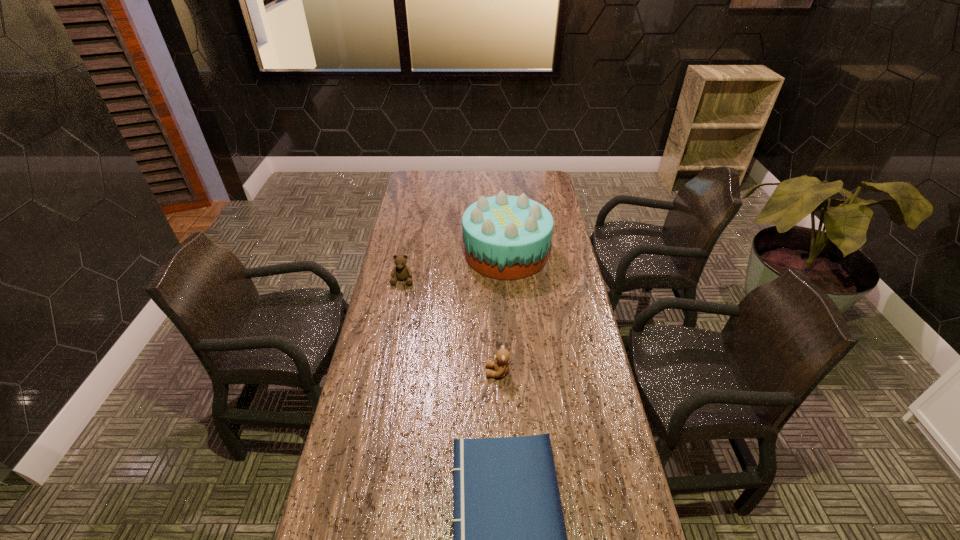
What are the coordinates of `cake` in the screenshot? It's located at (506, 237).

I want to click on the farther teddy bear, so click(x=402, y=272).

The width and height of the screenshot is (960, 540). What are the coordinates of `the left teddy bear` in the screenshot? It's located at (402, 272).

You are a GUI agent. You are given a task and a screenshot of the screen. Output one action in this format:
    pyautogui.click(x=<x>, y=<y>)
    Task: Click on the second nearest object
    Image resolution: width=960 pixels, height=540 pixels.
    Given the screenshot: What is the action you would take?
    pyautogui.click(x=501, y=365)

You are a GUI agent. You are given a task and a screenshot of the screen. Output one action in this format:
    pyautogui.click(x=<x>, y=<y>)
    Task: Click on the right teddy bear
    
    Given the screenshot: What is the action you would take?
    pyautogui.click(x=501, y=365)

The width and height of the screenshot is (960, 540). Identify the location of free space located on the front of the cake. (515, 366).

Locate an element on the screen. free location located on the front-facing side of the farther teddy bear is located at coordinates (396, 318).

The width and height of the screenshot is (960, 540). What are the coordinates of `vacant region located 0.080m on the front-facing side of the right teddy bear` in the screenshot? It's located at (461, 372).

Find the location of a particular element. free location located on the front-facing side of the right teddy bear is located at coordinates (431, 372).

This screenshot has width=960, height=540. I want to click on free region located on the front-facing side of the right teddy bear, so click(x=435, y=372).